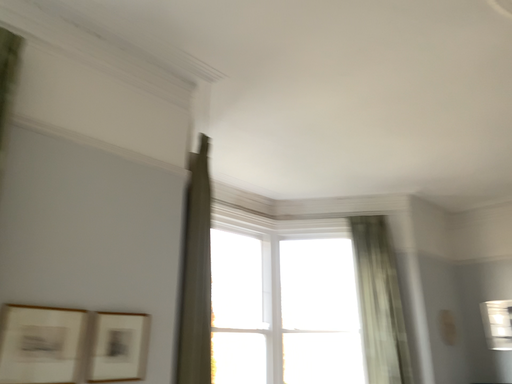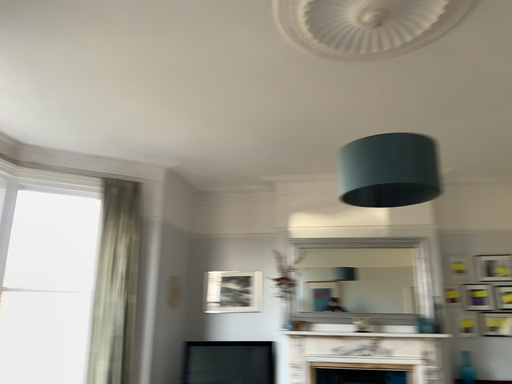
Question: How did the camera likely rotate when shooting the video?

Choices:
 (A) rotated right
 (B) rotated left

Answer: (A)